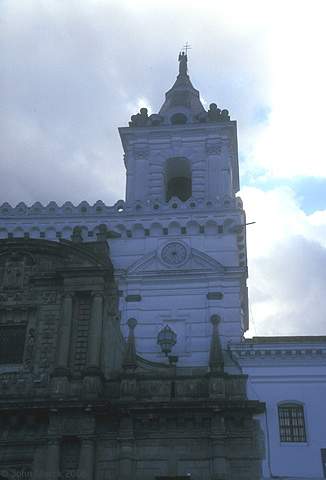
Find the location of a particular element. The image size is (326, 480). column is located at coordinates (95, 313), (62, 358), (53, 448), (83, 458).